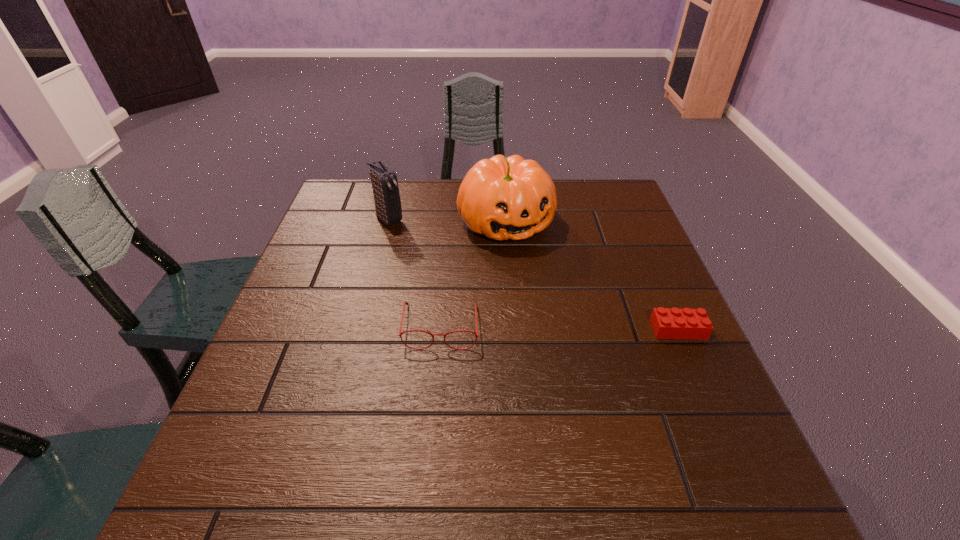
Image resolution: width=960 pixels, height=540 pixels. I want to click on vacant region between the pumpkin and the Lego, so click(592, 276).

Where is `empty space between the third tallest object and the pumpkin`? The width and height of the screenshot is (960, 540). empty space between the third tallest object and the pumpkin is located at coordinates (473, 274).

The image size is (960, 540). What are the coordinates of `unoccupied position between the leftmost object and the pumpkin` in the screenshot? It's located at (447, 220).

What are the coordinates of `free space between the third tallest object and the pumpkin` in the screenshot? It's located at (473, 274).

Locate an element on the screen. the second closest object relative to the leftmost object is located at coordinates (405, 303).

This screenshot has height=540, width=960. Identify the location of object that ranks as the third closest to the clutch bag. (667, 323).